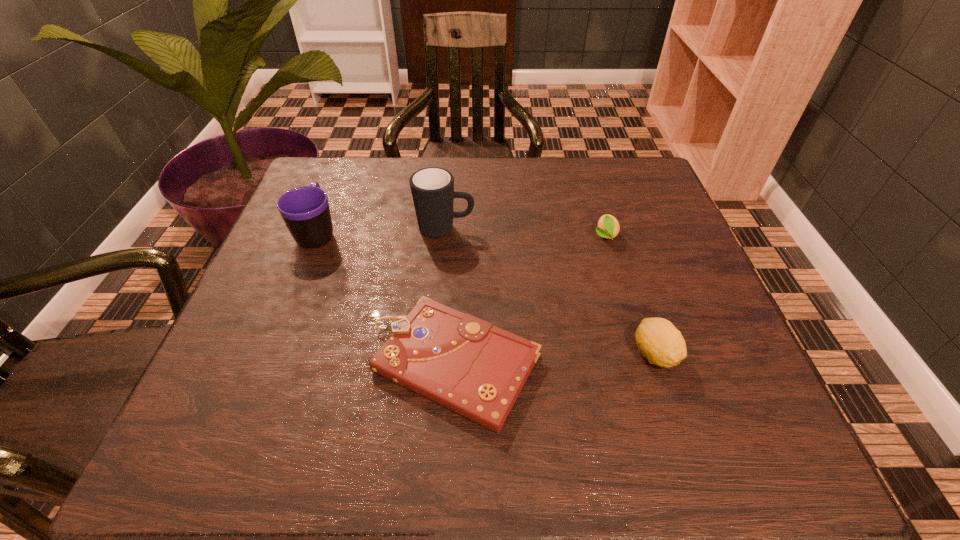
This screenshot has width=960, height=540. In order to click on the tallest object in this screenshot , I will do `click(432, 188)`.

Identify the location of the right mug. Image resolution: width=960 pixels, height=540 pixels. (432, 188).

This screenshot has width=960, height=540. Find the location of `the second tallest object`. the second tallest object is located at coordinates (305, 210).

You are a GUI agent. You are given a task and a screenshot of the screen. Output one action in this format:
    pyautogui.click(x=<x>, y=<y>)
    Task: Click on the shorter mug
    
    Given the screenshot: What is the action you would take?
    pyautogui.click(x=305, y=210)

You are a GUI agent. You are given a task and a screenshot of the screen. Output one action in this format:
    pyautogui.click(x=<x>, y=<y>)
    Task: Click on the taller lemon
    Image resolution: width=960 pixels, height=540 pixels.
    Given the screenshot: What is the action you would take?
    pyautogui.click(x=659, y=341)

Where is `the third shortest object`? the third shortest object is located at coordinates (659, 341).

Identify the location of the second shortest object. (608, 227).

This screenshot has width=960, height=540. Identify the location of the shorter lemon. (608, 227).

What are the coordinates of `notebook` in the screenshot? It's located at (477, 370).

Locate an element on the screen. vacant area situated on the side of the right mug with the handle is located at coordinates (645, 229).